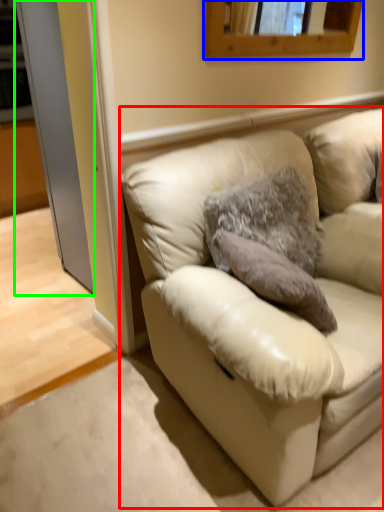
Question: Which object is positioned farthest from studio couch (highlighted by a red box)? Select from mirror (highlighted by a blue box) and glass door (highlighted by a green box).

Choices:
 (A) mirror
 (B) glass door

Answer: (B)